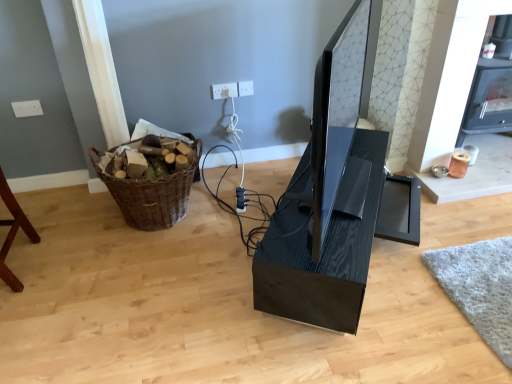
Find the location of a particular element. The height and width of the screenshot is (384, 512). free location to the right of black glossy computer desk at center is located at coordinates (459, 230).